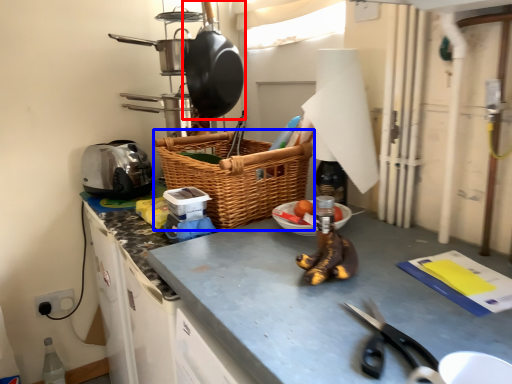
Question: Which object is closer to the camera taking this photo, frying pan (highlighted by a red box) or picnic basket (highlighted by a blue box)?

Choices:
 (A) frying pan
 (B) picnic basket

Answer: (B)